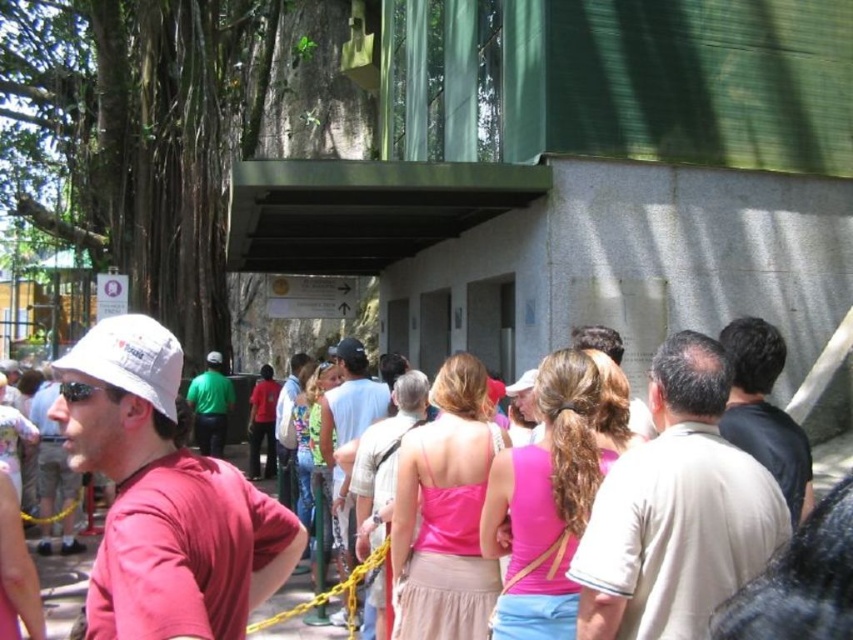
Question: Is white matte baseball hat at left further to the viewer compared to green fabric shirt at center?

Choices:
 (A) yes
 (B) no

Answer: (B)

Question: Which of the following is the closest to the observer?

Choices:
 (A) (618, 627)
 (B) (62, 554)
 (C) (604, 348)
 (D) (135, 444)

Answer: (D)

Question: Can you confirm if black matte baseball hat at center is thinner than green matte baseball cap at center?

Choices:
 (A) no
 (B) yes

Answer: (A)

Question: Which point is farther to the camera?

Choices:
 (A) green matte baseball cap at center
 (B) light brown leather jacket at center
 (C) black matte baseball hat at center
 (D) matte pink tank top at center

Answer: (A)

Question: Is white matte hat at left positioned behind matte pink tank top at center?

Choices:
 (A) no
 (B) yes

Answer: (A)

Question: Which object is positioned closest to the green matte baseball cap at center?

Choices:
 (A) white matte hat at left
 (B) matte white hat at center
 (C) green fabric shirt at center
 (D) light beige shirt at center

Answer: (C)